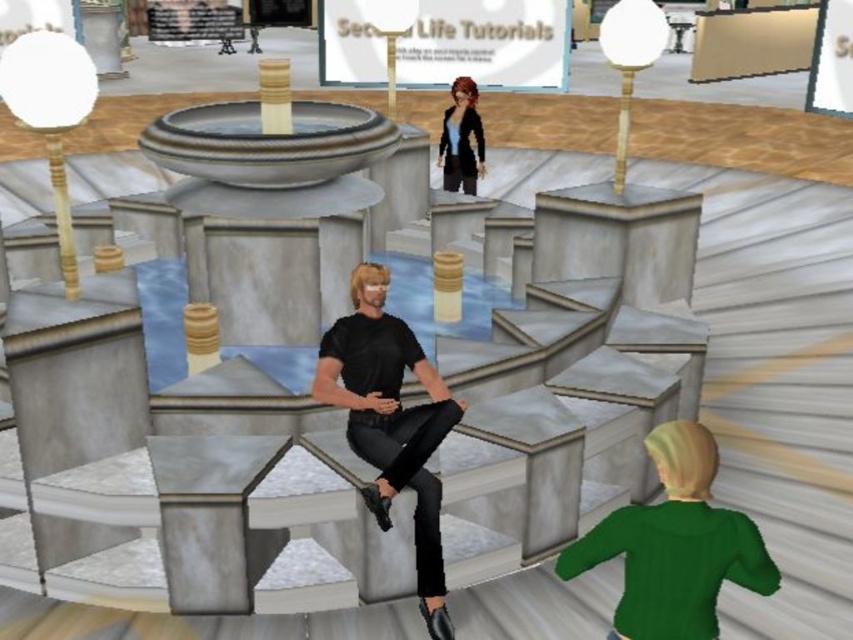
Is the position of green matte sweater at lower right more distant than that of matte black jacket at upper center?

No, it is not.

Is point (633, 624) less distant than point (447, 161)?

Yes.

Find the location of `green matte sweater at lower right`. green matte sweater at lower right is located at coordinates tap(675, 545).

Which is behind, point (351, 298) or point (471, 180)?

Point (471, 180)

Where is `black matte pants at center`? This screenshot has height=640, width=853. black matte pants at center is located at coordinates (390, 420).

Is point (630, 552) more distant than point (369, 396)?

That is False.

Can you confirm if green matte sweater at lower right is wider than black matte pants at center?

No.

Is point (584, 556) positioned before point (312, 381)?

Yes, point (584, 556) is closer to viewer.

Where is `green matte sweater at lower right`? This screenshot has height=640, width=853. green matte sweater at lower right is located at coordinates (675, 545).